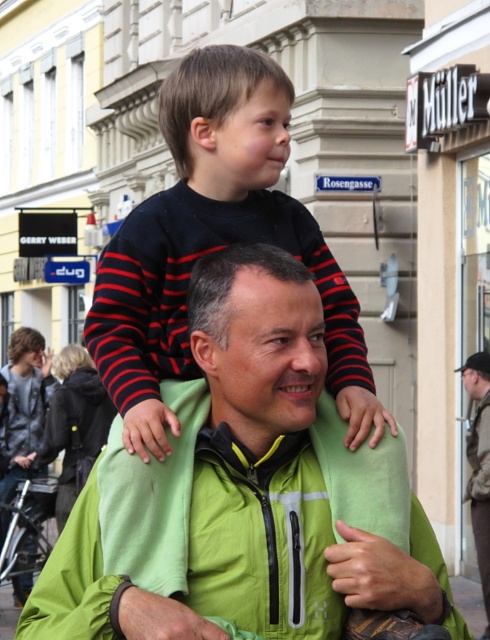
Question: Is green soft jacket at center further to the viewer compared to black striped shirt at center?

Choices:
 (A) yes
 (B) no

Answer: (B)

Question: Which point appears farthest from the camera in this image?

Choices:
 (A) tap(215, 508)
 (B) tap(240, 189)

Answer: (B)

Question: Is green soft jacket at center wider than black striped shirt at center?

Choices:
 (A) no
 (B) yes

Answer: (B)

Question: Is green soft jacket at center to the left of black striped shirt at center from the viewer's perspective?

Choices:
 (A) no
 (B) yes

Answer: (A)

Question: Which object is farther from the camera taking this photo?

Choices:
 (A) black striped shirt at center
 (B) green soft jacket at center

Answer: (A)